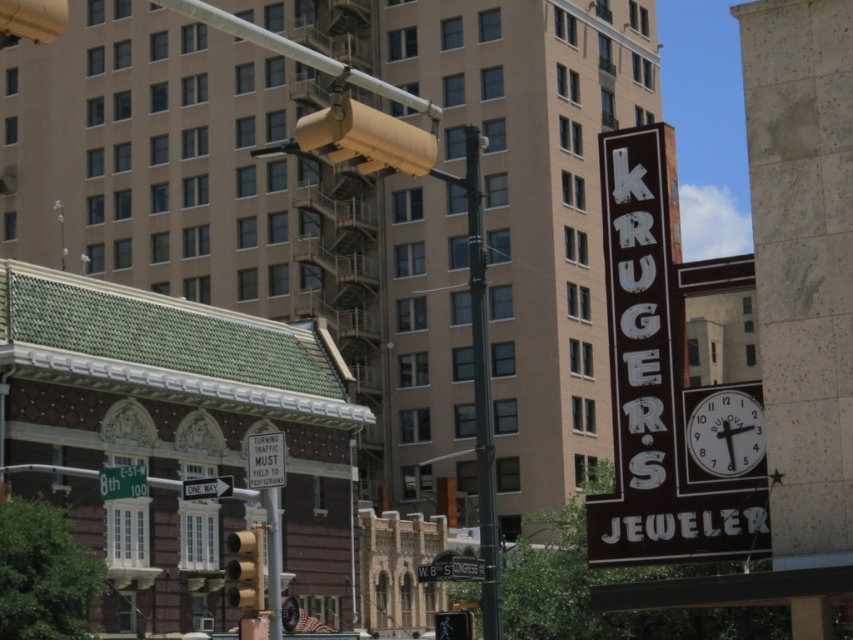
Find the location of a particular element. metallic yellow traffic light at center is located at coordinates (245, 570).

This screenshot has height=640, width=853. In order to click on metallic yellow traffic light at center in this screenshot , I will do `click(245, 570)`.

At what (x,y) coordinates should I click in order to perform the action: click on metallic yellow traffic light at center. Please return your answer as a coordinate pair (x, y). The width and height of the screenshot is (853, 640). Looking at the image, I should click on (245, 570).

Between white glossy clock at right and metallic gray street sign at lower center, which one is positioned higher?

white glossy clock at right is higher up.

Who is lower down, white glossy clock at right or metallic gray street sign at lower center?

metallic gray street sign at lower center is lower down.

Where is `white glossy clock at right`? The width and height of the screenshot is (853, 640). white glossy clock at right is located at coordinates (726, 433).

Is matte yellow traffic light at lower center taller than white plastic one way sign at lower left?

Correct, matte yellow traffic light at lower center is much taller as white plastic one way sign at lower left.

Is matte yellow traffic light at lower center wider than white plastic one way sign at lower left?

In fact, matte yellow traffic light at lower center might be narrower than white plastic one way sign at lower left.

Find the location of `matte yellow traffic light at lower center`. matte yellow traffic light at lower center is located at coordinates (453, 625).

Locate an element on the screen. This screenshot has height=640, width=853. matte yellow traffic light at lower center is located at coordinates (453, 625).